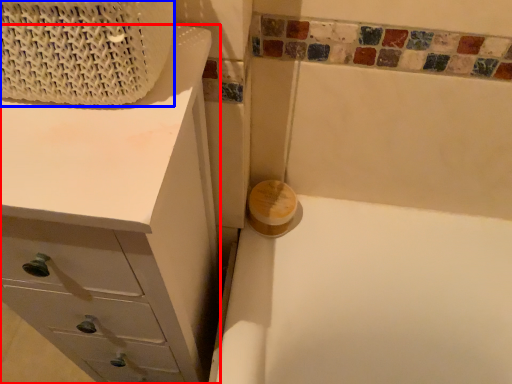
Question: Which point is further to the camera, chest of drawers (highlighted by a red box) or basket (highlighted by a blue box)?

Choices:
 (A) chest of drawers
 (B) basket

Answer: (A)